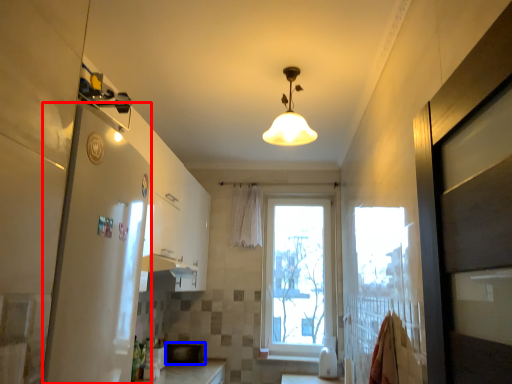
Question: Among these objects, which one is farthest to the camera, screen door (highlighted by a red box) or appliance (highlighted by a blue box)?

Choices:
 (A) screen door
 (B) appliance

Answer: (B)